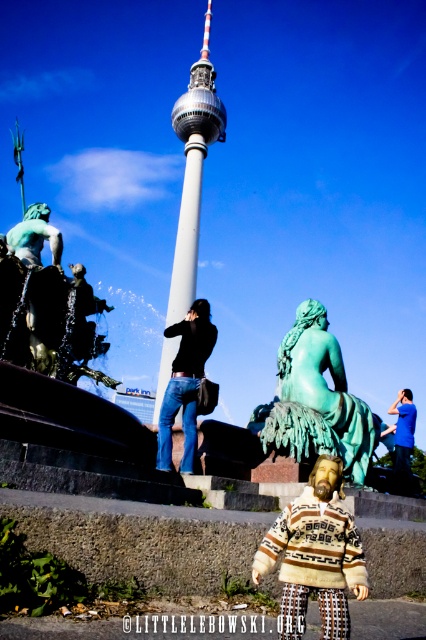
Question: Is green patina statue at center further to the viewer compared to smooth white tower at center?

Choices:
 (A) no
 (B) yes

Answer: (A)

Question: Which point is farther to the camera?

Choices:
 (A) (406, 426)
 (B) (301, 624)
 (C) (195, 234)
 (D) (178, 381)

Answer: (C)

Question: Which point is farther to the camera?

Choices:
 (A) smooth white tower at center
 (B) blue cotton shirt at center

Answer: (B)

Question: Is green patina statue at center positioned in front of blue cotton shirt at center?

Choices:
 (A) yes
 (B) no

Answer: (A)

Question: Does green patina statue at left appear under white smooth tower at center?

Choices:
 (A) no
 (B) yes

Answer: (B)

Question: Which point appears closest to the camera in this image?

Choices:
 (A) tap(328, 461)
 (B) tap(402, 458)
 (C) tap(192, 342)
 (D) tap(31, 209)

Answer: (A)